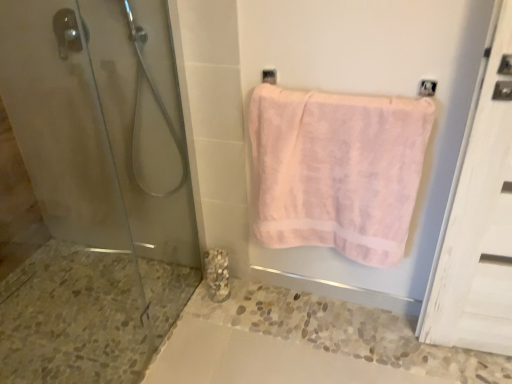
This screenshot has height=384, width=512. In order to click on free spot to the right of marble textured at lower left in this screenshot , I will do `click(252, 299)`.